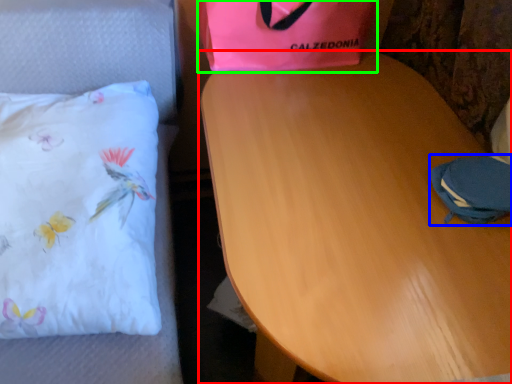
Question: Which object is the farthest from table (highlighted by a red box)? Choose among these: pouch (highlighted by a blue box) or gift bag (highlighted by a green box).

Choices:
 (A) pouch
 (B) gift bag

Answer: (B)